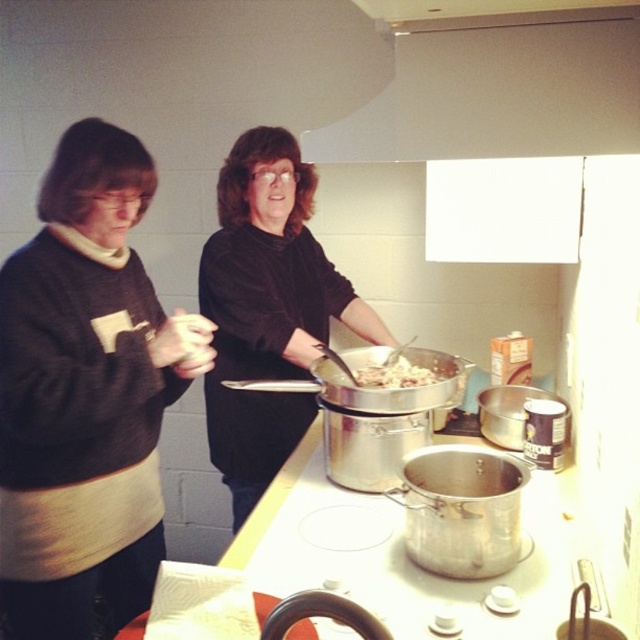
Does matte black sweater at left have a greater width compared to white creamy food at center?

Correct, the width of matte black sweater at left exceeds that of white creamy food at center.

I want to click on matte black sweater at left, so click(84, 396).

Between white matte exhaust hood at upper center and black matte shirt at center, which one is positioned higher?

Positioned higher is white matte exhaust hood at upper center.

Which is below, white matte exhaust hood at upper center or black matte shirt at center?

black matte shirt at center

Locate an element on the screen. The width and height of the screenshot is (640, 640). white matte exhaust hood at upper center is located at coordinates (499, 90).

This screenshot has width=640, height=640. I want to click on white matte exhaust hood at upper center, so click(x=499, y=90).

Between point (88, 138) and point (232, 508), which one is positioned in front?

Point (88, 138) is in front.

Is matte black sweater at left thinner than black matte shirt at center?

Yes, matte black sweater at left is thinner than black matte shirt at center.

Between point (40, 392) and point (209, 385), which one is positioned in front?

Point (40, 392)

This screenshot has height=640, width=640. I want to click on matte black sweater at left, so click(84, 396).